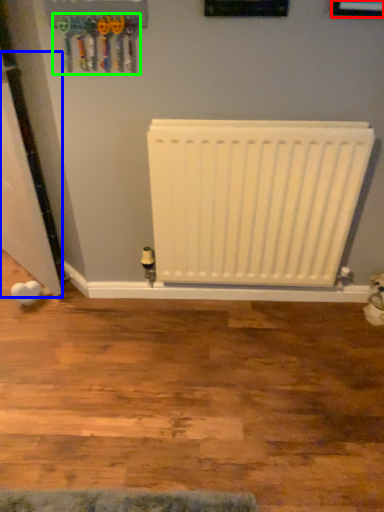
Question: Which is farther away from picture frame (highlighted by a red box)? door (highlighted by a blue box) or tool (highlighted by a green box)?

Choices:
 (A) door
 (B) tool

Answer: (A)